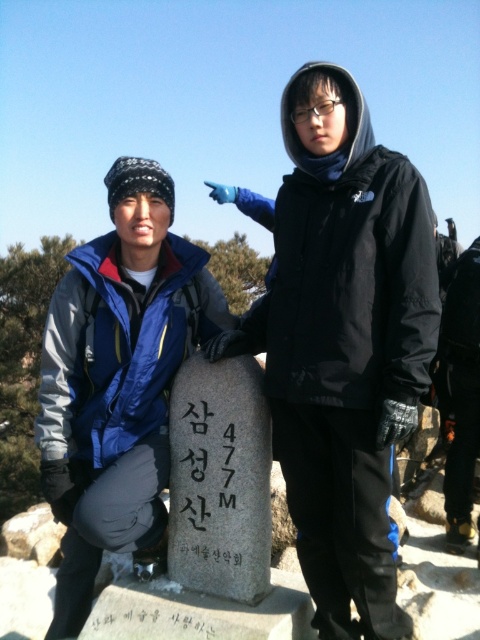
You are a photographer trying to capture both the blue fleece jacket at lower left and the black stone marker at center in a single frame. Based on their sizes, which object would appear larger in the photo?

The blue fleece jacket at lower left would appear larger in the photo since it is taller than the black stone marker at center according to the description.

What does the point at coordinates (x=219, y=480) in the image indicate?

The point at coordinates (x=219, y=480) marks the gray stone at center.